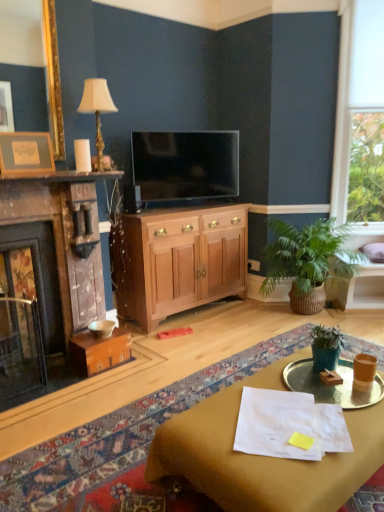
Question: In the image, is matte black tv at center on the left side or the right side of wooden fireplace at left?

Choices:
 (A) left
 (B) right

Answer: (B)

Question: Which is correct: matte black tv at center is inside wooden fireplace at left, or outside of it?

Choices:
 (A) outside
 (B) inside

Answer: (A)

Question: Which is farther from the black plastic phone at center?

Choices:
 (A) wooden fireplace at left
 (B) transparent glass window at upper right
 (C) purple fabric pillow at upper right
 (D) translucent glass tray at center
 (E) matte brown desk at lower right

Answer: (E)

Question: Considering the real-world distances, which object is farthest from the transparent glass window at upper right?

Choices:
 (A) green matte plant pot at center, which is the first houseplant in front-to-back order
 (B) purple fabric pillow at upper right
 (C) black plastic phone at center
 (D) wooden fireplace at left
 (E) translucent glass tray at center

Answer: (D)